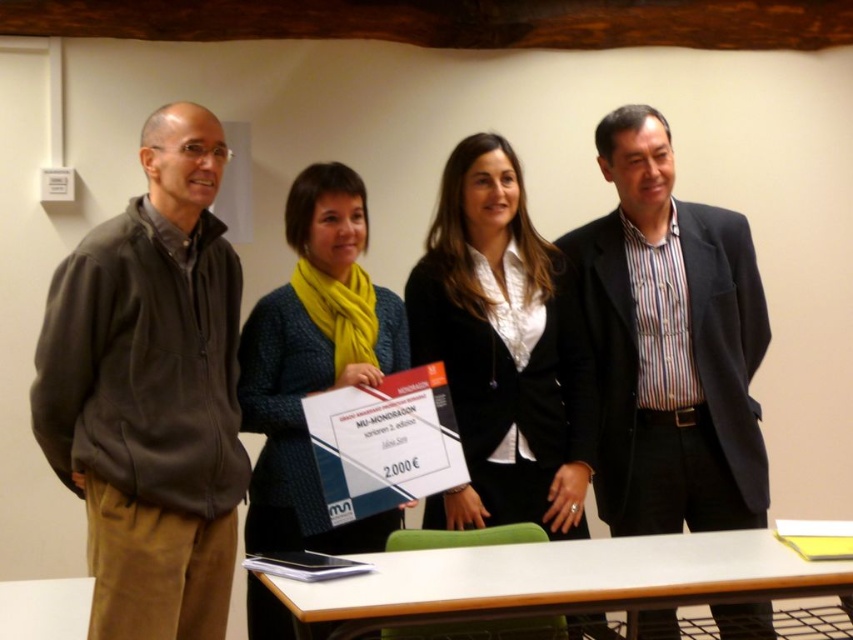
Does point (144, 520) come in front of point (728, 339)?

Yes, point (144, 520) is closer to viewer.

The width and height of the screenshot is (853, 640). Identify the location of dark gray fleece jacket at left. (151, 392).

Describe the element at coordinates (151, 392) in the screenshot. I see `dark gray fleece jacket at left` at that location.

Which is below, dark gray fleece jacket at left or knitted wool scarf at center?

knitted wool scarf at center

Describe the element at coordinates (151, 392) in the screenshot. The height and width of the screenshot is (640, 853). I see `dark gray fleece jacket at left` at that location.

I want to click on dark gray fleece jacket at left, so click(x=151, y=392).

Between black matte blazer at center and white wood table at lower center, which one is positioned higher?

black matte blazer at center is above.

The height and width of the screenshot is (640, 853). Describe the element at coordinates (502, 349) in the screenshot. I see `black matte blazer at center` at that location.

Where is `black matte blazer at center`? The width and height of the screenshot is (853, 640). black matte blazer at center is located at coordinates (502, 349).